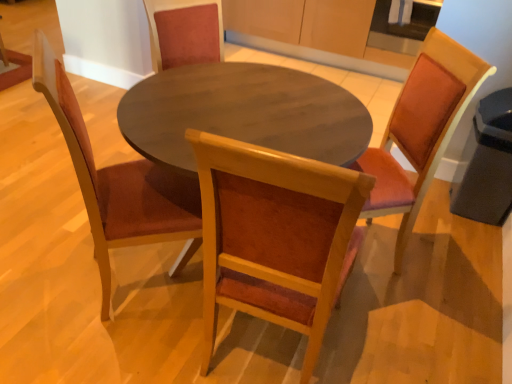
Where is `vacant area that is in front of wooden chair at left, arranged as the third chair when viewed from the right`? This screenshot has width=512, height=384. vacant area that is in front of wooden chair at left, arranged as the third chair when viewed from the right is located at coordinates pyautogui.click(x=104, y=347).